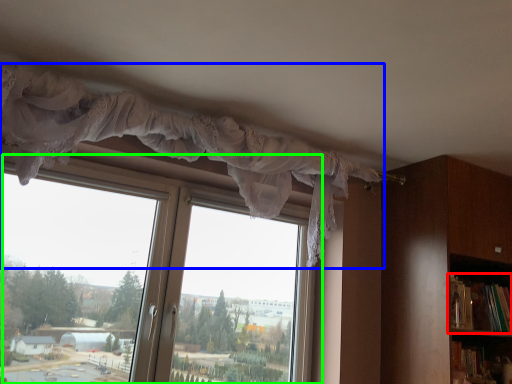
Question: Which object is the closest to the book (highlighted by a red box)? Choose among these: curtain (highlighted by a blue box) or window (highlighted by a green box).

Choices:
 (A) curtain
 (B) window

Answer: (A)